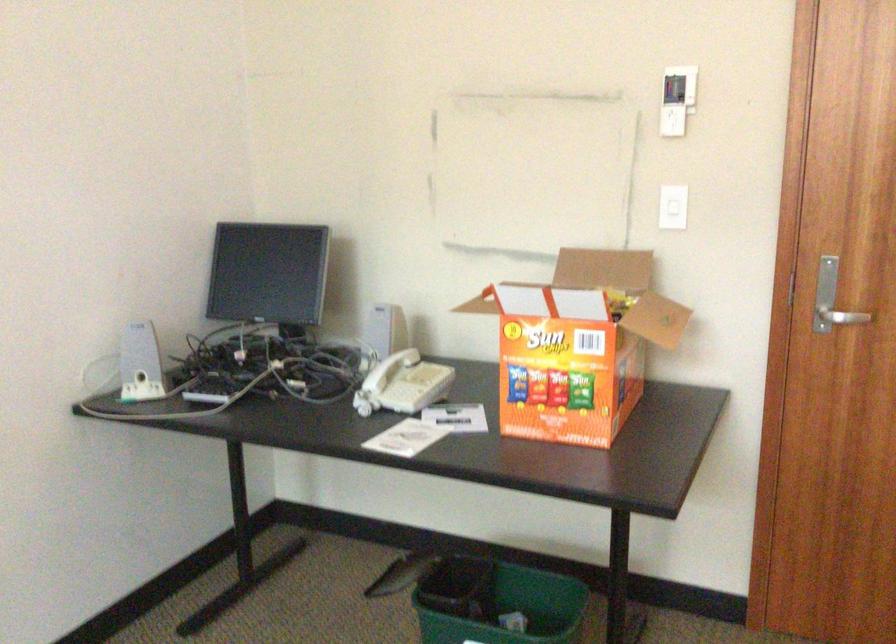
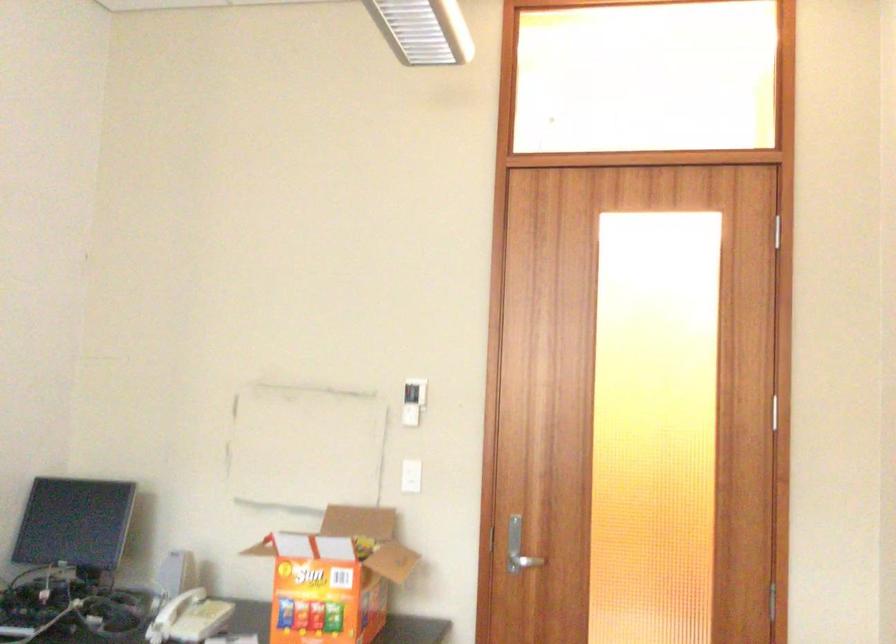
In the second image, find the point that corresponds to pixel 675 99 in the first image.

(412, 401)